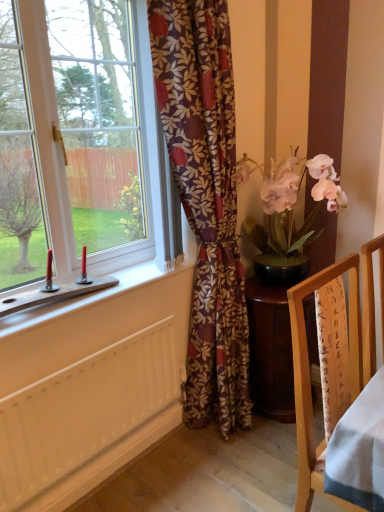
Question: From the image's perspective, is white painted wood radiator at lower left positioned above or below white plastic window at left?

Choices:
 (A) below
 (B) above

Answer: (A)

Question: Would you say white painted wood radiator at lower left is to the left or to the right of white plastic window at left in the picture?

Choices:
 (A) right
 (B) left

Answer: (A)

Question: Which is nearer to the white painted wood radiator at lower left?

Choices:
 (A) wooden frame at right
 (B) wooden desk at center
 (C) pink silk orchid at right
 (D) floral-patterned fabric at center
 (E) white plastic window at left

Answer: (D)

Question: Estimate the real-world distances between objects in this image. Which object is farther from the floral-patterned fabric at center?

Choices:
 (A) wooden frame at right
 (B) wooden desk at center
 (C) white plastic window at left
 (D) white painted wood radiator at lower left
 (E) pink silk orchid at right

Answer: (A)